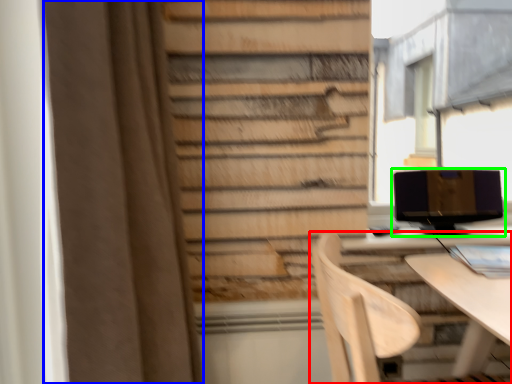
Question: Which object is positioned farthest from chair (highlighted by a red box)? Select from curtain (highlighted by a blue box) and computer monitor (highlighted by a green box).

Choices:
 (A) curtain
 (B) computer monitor

Answer: (B)